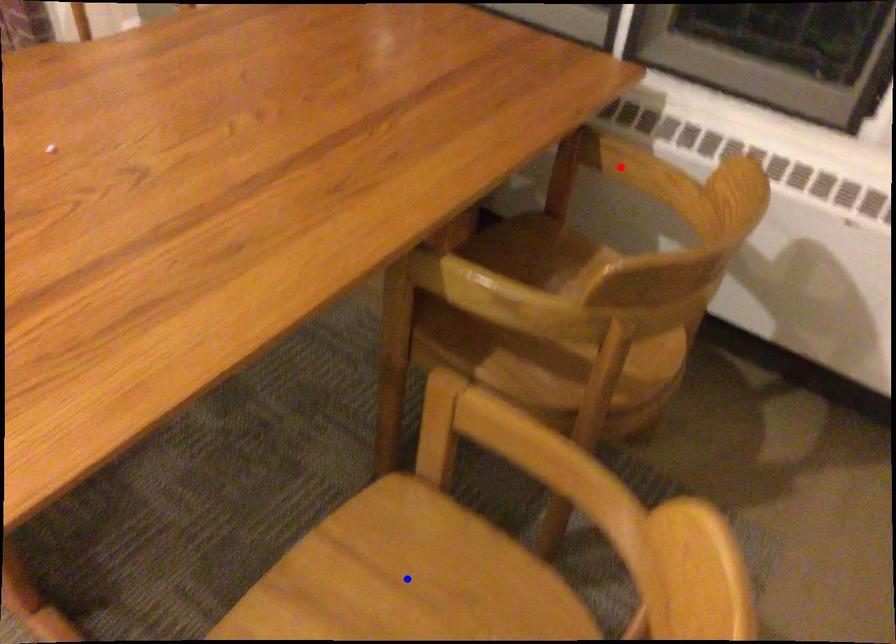
Question: Two points are marked on the image. Which point is closer to the camera?

Choices:
 (A) Blue point is closer.
 (B) Red point is closer.

Answer: (A)